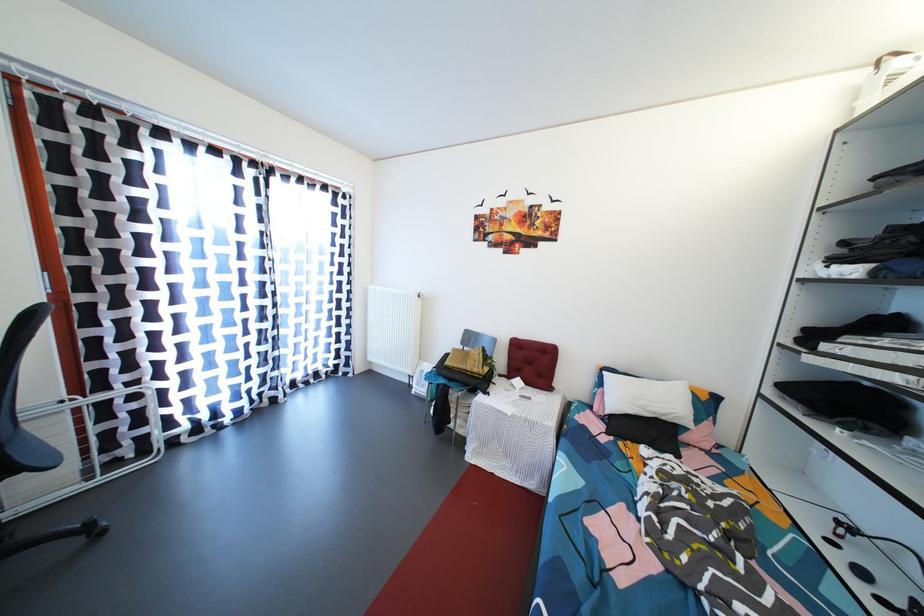
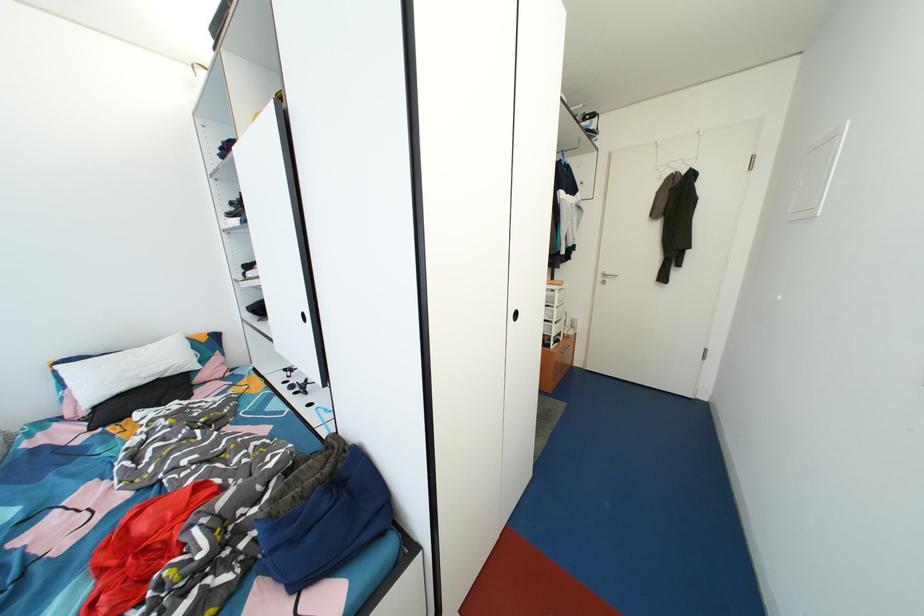
Find the pixel in the second image that matches point 845,541 in the first image.

(295, 382)